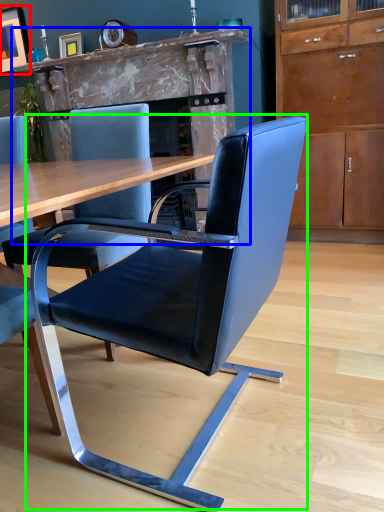
Question: Which object is positioned closest to picture frame (highlighted by a red box)? Select from fireplace (highlighted by a blue box) and chair (highlighted by a green box).

Choices:
 (A) fireplace
 (B) chair

Answer: (A)